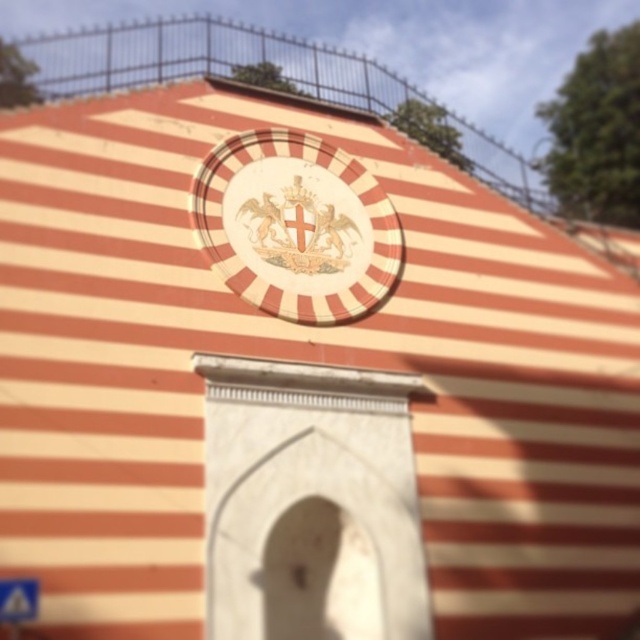
Looking at this image, you are a city planner assessing the building facade. The white glossy emblem at center and the blue plastic street sign at lower left are both important elements. Which object has a greater width?

The white glossy emblem at center has a greater width than the blue plastic street sign at lower left.

You are a delivery driver who needs to deliver a package to the building with the white glossy emblem at center. However, you notice a blue plastic street sign at lower left nearby. Which object should you look for first to ensure you are heading in the right direction?

You should look for the blue plastic street sign at lower left first because the white glossy emblem at center is positioned on its right side, meaning the street sign is to the left of the emblem and closer to the delivery route.